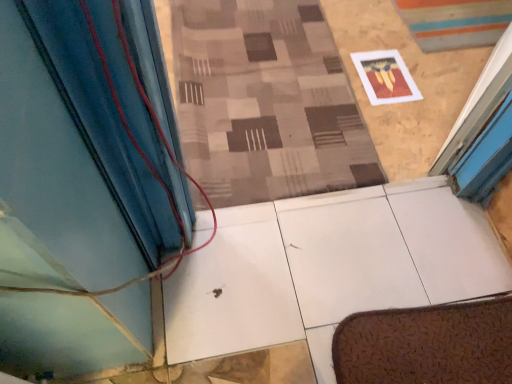
This screenshot has height=384, width=512. Find the location of `vacant area on top of matte white picture frame at upper right (from a real-world perspective)`. vacant area on top of matte white picture frame at upper right (from a real-world perspective) is located at coordinates (388, 75).